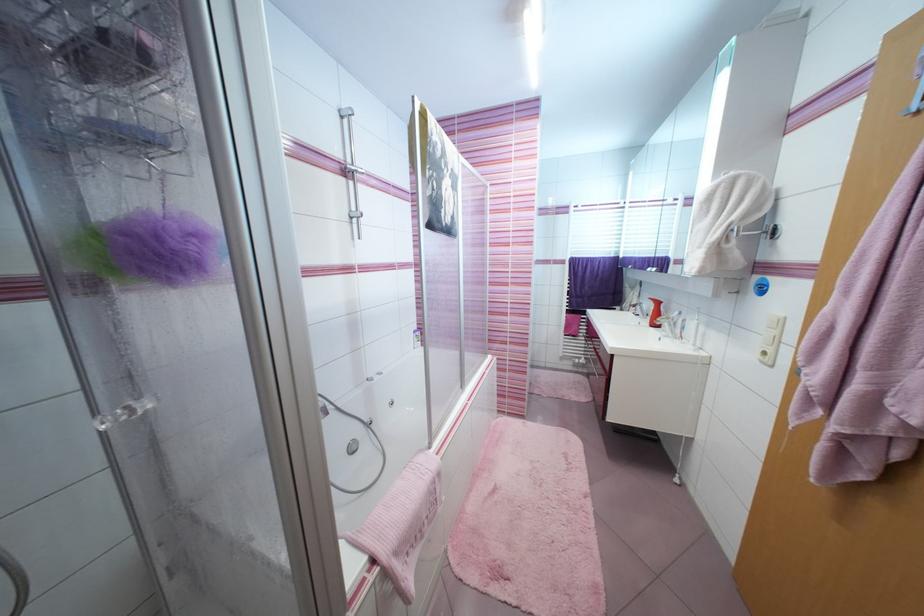
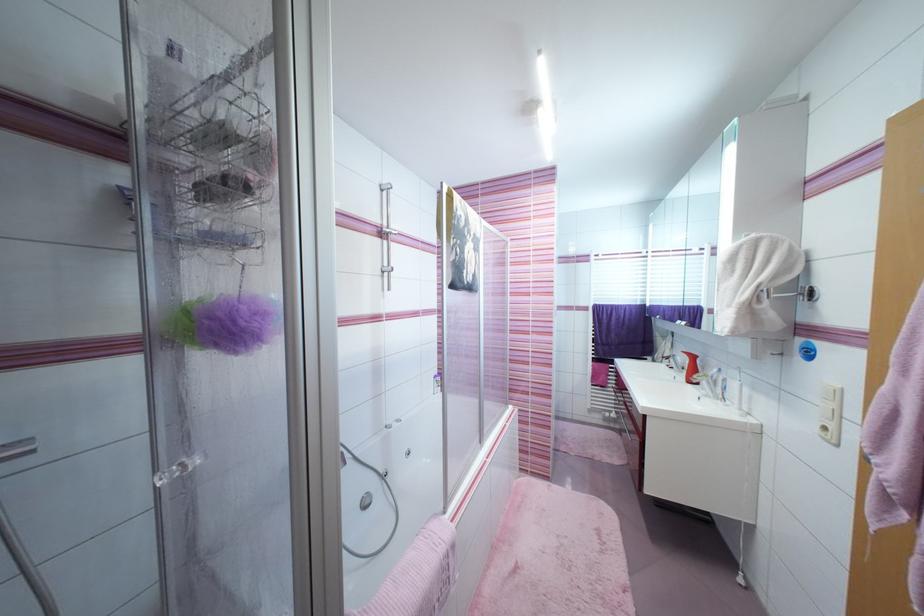
Locate, in the second image, the point that corresponds to point (382, 448) in the first image.

(395, 504)